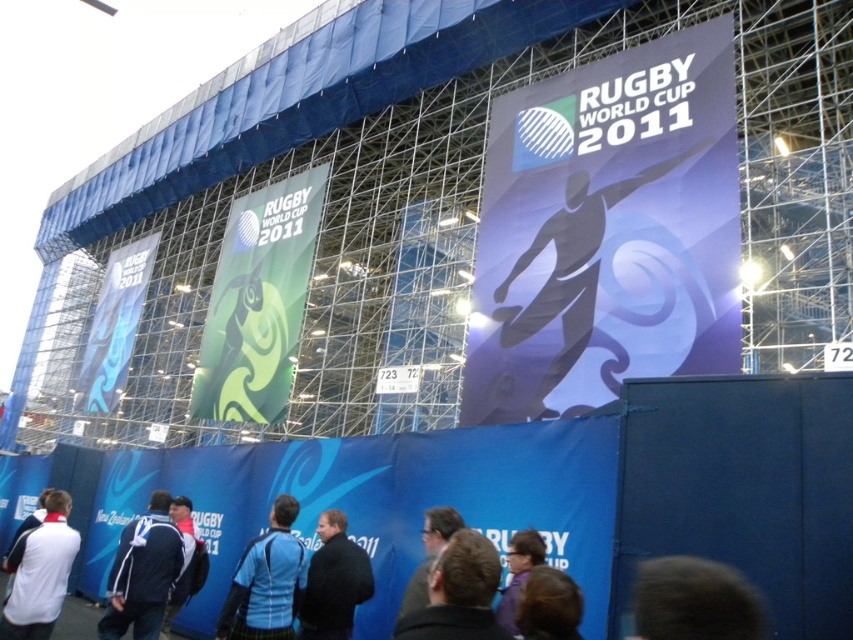
You are a photographer at the Rugby World Cup 2011 venue. You notice two elements in your shot, the dark brown hair at lower right and the blue fabric jacket at lower left. Which element is positioned higher in the frame?

The dark brown hair at lower right is positioned higher than the blue fabric jacket at lower left.

You are a photographer standing at the base of the scaffolding at the Rugby World Cup 2011 venue. You notice two points marked on the scaffolding structure. The first point is located at coordinates point (325, 589) and the second at point (439, 545). If you want to take a photo that includes both points without moving your camera position, which point will appear closer to the center of your camera viewfinder?

Point (325, 589) is further to the camera than point (439, 545). Therefore, point (439, 545) will appear closer to the center of your camera viewfinder since it is nearer to the camera position.

You are a photographer standing at the camera position. You want to capture a closeup shot of the dark brown hair at lower right. Given that your telephoto lens can focus on objects within 20 meters, will you be able to take the closeup without moving closer?

The dark brown hair at lower right is 20.27 meters from the camera, which is slightly beyond the telephoto lens range of 20 meters. Therefore, you will not be able to take the closeup without moving closer.